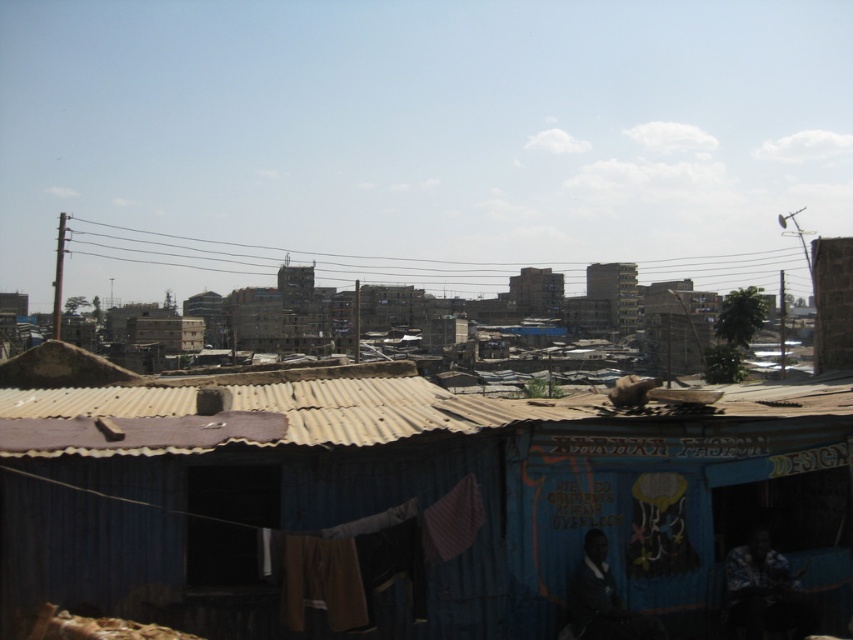
Question: Is blue corrugated metal hut at center smaller than corrugated metal roof at center?

Choices:
 (A) yes
 (B) no

Answer: (A)

Question: Can you confirm if blue corrugated metal hut at center is wider than corrugated metal roof at center?

Choices:
 (A) yes
 (B) no

Answer: (B)

Question: Which object is closer to the camera taking this photo?

Choices:
 (A) blue corrugated metal hut at center
 (B) corrugated metal roof at center

Answer: (B)

Question: Is blue corrugated metal hut at center bigger than corrugated metal roof at center?

Choices:
 (A) yes
 (B) no

Answer: (B)

Question: Which object is closer to the camera taking this photo?

Choices:
 (A) corrugated metal roof at center
 (B) blue corrugated metal hut at center

Answer: (A)